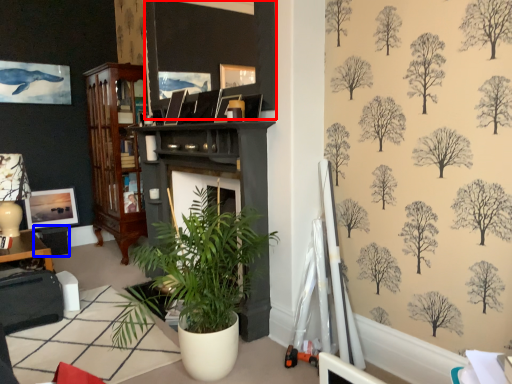
Question: Which point is further to the camera, picture frame (highlighted by a red box) or table (highlighted by a blue box)?

Choices:
 (A) picture frame
 (B) table

Answer: (B)